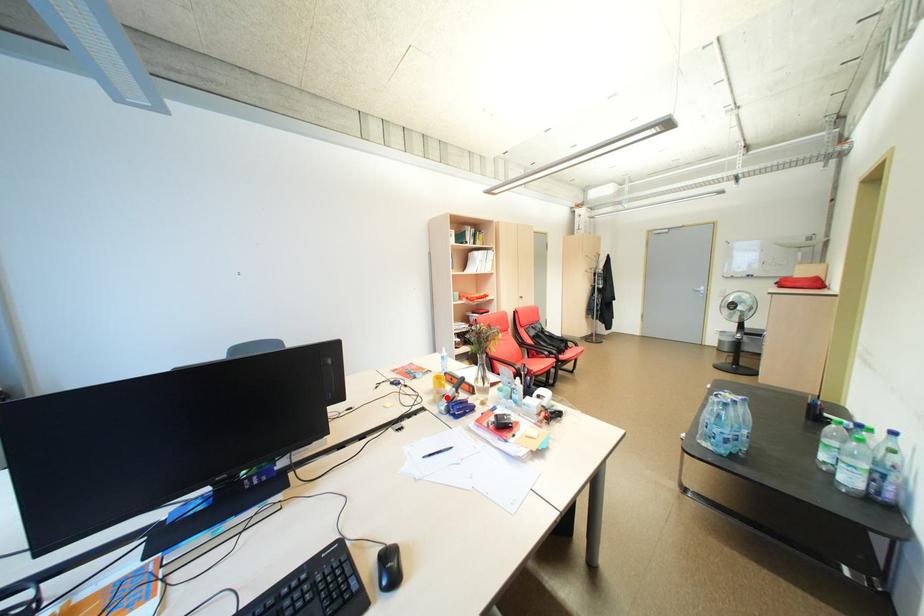
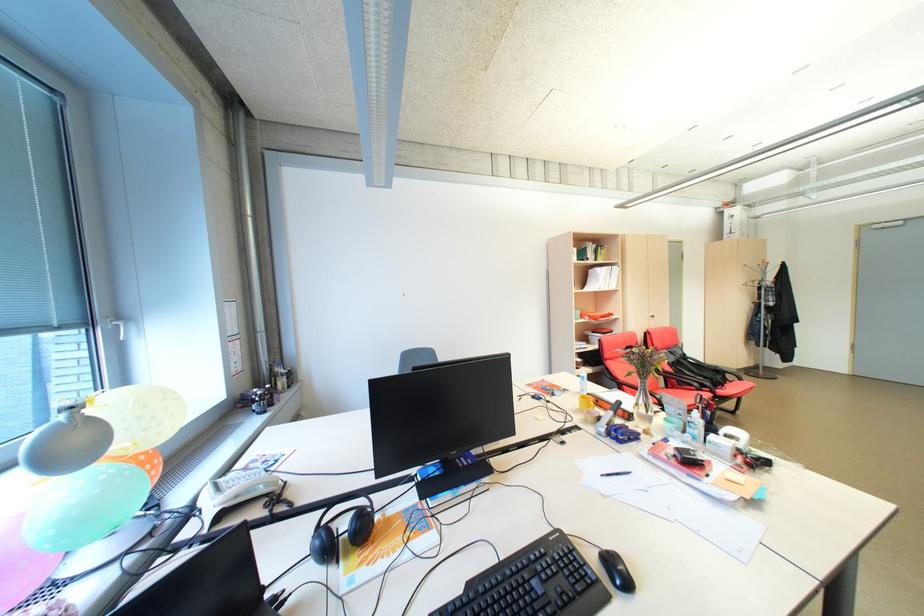
Where in the second image is the point corresponding to the highlighted location from the first image?

(600, 418)